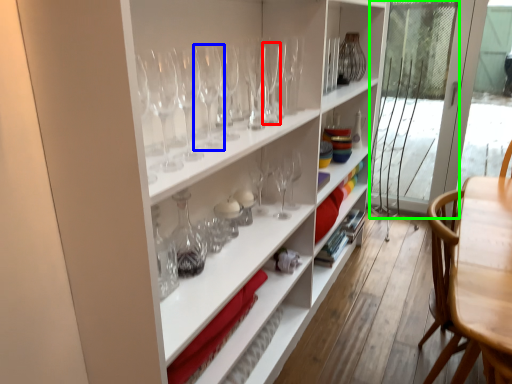
Question: Which object is positioned farthest from wine glass (highlighted by a red box)? Select from wine glass (highlighted by a blue box) and screen door (highlighted by a green box).

Choices:
 (A) wine glass
 (B) screen door

Answer: (B)